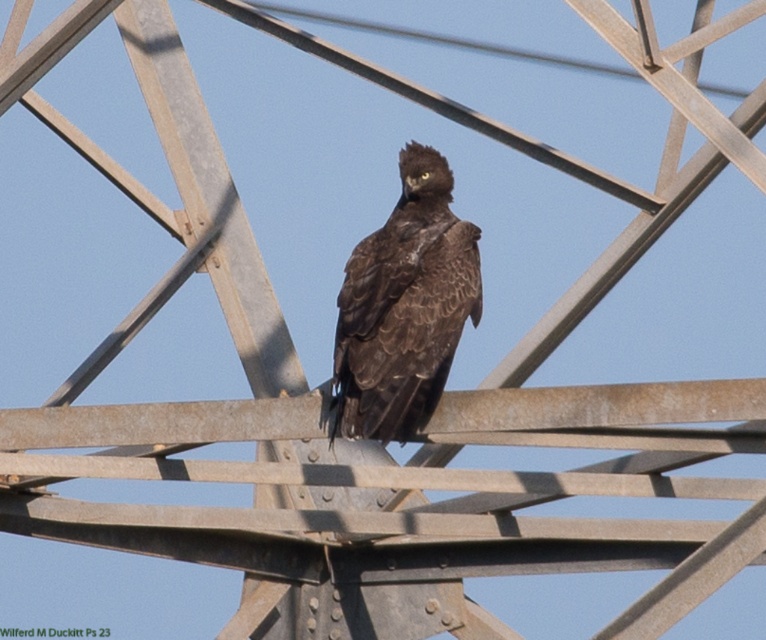
You are a drone operator trying to capture footage of the brown feathered eagle at center. The brushed metal power line at upper center is in your flight path. Can your drone, which has a maximum flight range of 15 meters, reach the eagle without passing through the power line?

The distance between the brown feathered eagle at center and the brushed metal power line at upper center is 15.56 meters. Since the drone can only fly up to 15 meters, it cannot safely reach the eagle without exceeding its range or passing through the power line.

You are a wildlife photographer aiming to capture the brown feathered eagle at center. Based on the coordinates provided, where should you position your camera to ensure the eagle is centered in your shot?

The brown feathered eagle at center is located at coordinates point (404, 307), so you should position your camera to aim directly at that point to ensure the eagle is centered in your shot.

You are a photographer aiming to capture the brown feathered eagle at center and the brushed metal power line at upper center in a single frame. Based on their sizes, which object should you focus on first to ensure both are in sharp focus?

The brown feathered eagle at center is smaller than the brushed metal power line at upper center, so you should focus on the brushed metal power line at upper center first to ensure both are in sharp focus.